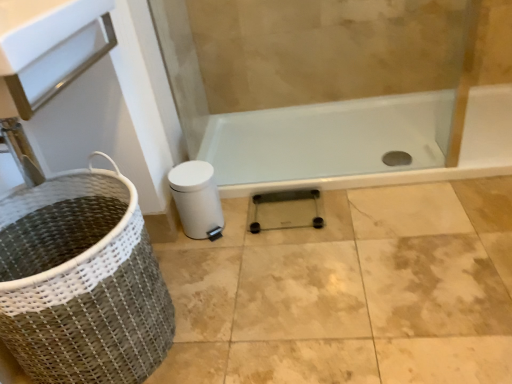
Locate an element on the screen. vacant space that's between transparent glass scale at center and woven fabric basket at lower left is located at coordinates (232, 278).